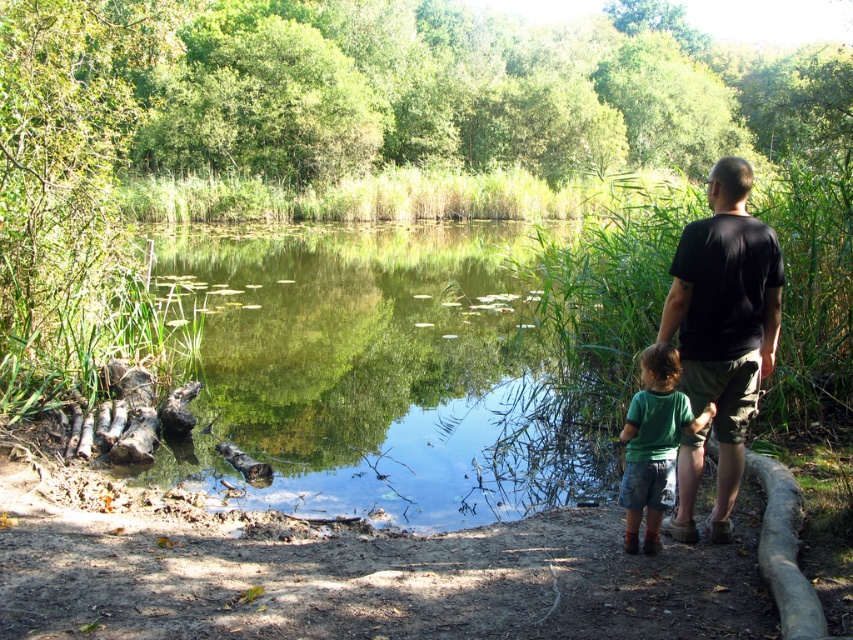
You are a photographer planning to take a portrait of the black cotton shirt at right and the green reflective water at center. Since you want to ensure both are in focus, you need to know their relative heights. Which object is taller?

The green reflective water at center is much taller than the black cotton shirt at right.

You are a photographer positioned at the center of the image. You want to take a picture of the black cotton shirt at right. Which direction should you move to get a better shot?

Since the black cotton shirt at right is located at point 0.500 on the x axis and 0.851 on the y axis, you should move to the right and upwards to get closer to the black cotton shirt at right for a better shot.

You are standing on the dirt path and want to take a photo of the green cotton shirt at lower center and the green reflective water at center. Which object should you focus on first if you want both to be in focus?

You should focus on the green cotton shirt at lower center first because it is closer to you than the green reflective water at center, which is further away. By focusing on the closer object, you can ensure both are in focus using depth of field.